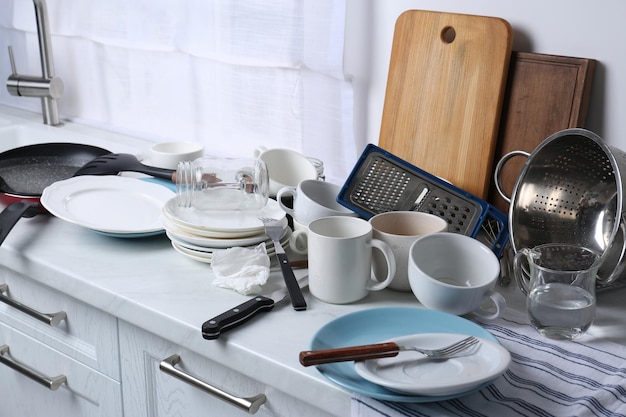
Find the location of `plates`. plates is located at coordinates (108, 208), (190, 222), (190, 231), (197, 240), (197, 248), (197, 252), (195, 257), (387, 327), (433, 368).